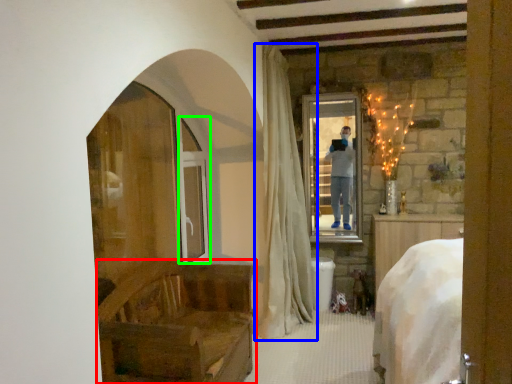
Question: Which object is the closest to the furniture (highlighted by a red box)? Choose among these: curtain (highlighted by a blue box) or screen door (highlighted by a green box).

Choices:
 (A) curtain
 (B) screen door

Answer: (A)